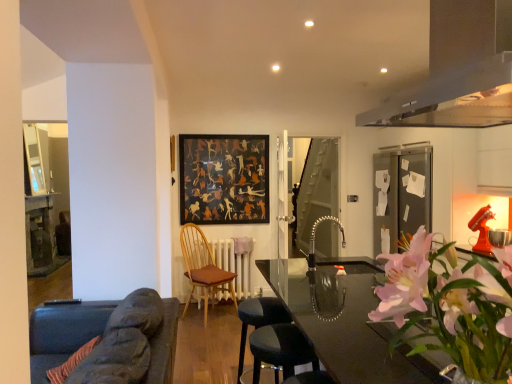
Question: Is dark gray fabric bar stool at lower center, arranged as the 1th bar stool when viewed from the front, thinner than satin black exhaust hood at upper right?

Choices:
 (A) no
 (B) yes

Answer: (B)

Question: Does dark gray fabric bar stool at lower center, acting as the second bar stool starting from the back, have a greater width compared to satin black exhaust hood at upper right?

Choices:
 (A) no
 (B) yes

Answer: (A)

Question: Does dark gray fabric bar stool at lower center, acting as the second bar stool starting from the back, have a lesser height compared to satin black exhaust hood at upper right?

Choices:
 (A) yes
 (B) no

Answer: (A)

Question: Is dark gray fabric bar stool at lower center, acting as the second bar stool starting from the back, positioned in front of satin black exhaust hood at upper right?

Choices:
 (A) yes
 (B) no

Answer: (B)

Question: Does dark gray fabric bar stool at lower center, acting as the second bar stool starting from the back, have a larger size compared to satin black exhaust hood at upper right?

Choices:
 (A) yes
 (B) no

Answer: (B)

Question: Is dark gray fabric bar stool at lower center, arranged as the 1th bar stool when viewed from the front, to the left of satin black exhaust hood at upper right from the viewer's perspective?

Choices:
 (A) yes
 (B) no

Answer: (A)

Question: Could wooden table at left, which is the first table in back-to-front order, be considered to be inside pink floral arrangement at right?

Choices:
 (A) yes
 (B) no

Answer: (B)

Question: From the image's perspective, is pink floral arrangement at right beneath wooden table at left, the 2th table when ordered from front to back?

Choices:
 (A) yes
 (B) no

Answer: (B)

Question: From a real-world perspective, is pink floral arrangement at right on top of wooden table at left, the 2th table when ordered from front to back?

Choices:
 (A) yes
 (B) no

Answer: (A)

Question: Can you confirm if pink floral arrangement at right is thinner than wooden table at left, which is the first table in back-to-front order?

Choices:
 (A) no
 (B) yes

Answer: (B)

Question: Is wooden table at left, the first table positioned from the left, at the back of pink floral arrangement at right?

Choices:
 (A) yes
 (B) no

Answer: (B)

Question: Considering the relative sizes of pink floral arrangement at right and wooden table at left, the first table positioned from the left, in the image provided, is pink floral arrangement at right wider than wooden table at left, the first table positioned from the left,?

Choices:
 (A) yes
 (B) no

Answer: (B)

Question: Could you tell me if black matte picture frame at center is turned towards transparent glass table at center, acting as the 1th table starting from the front?

Choices:
 (A) yes
 (B) no

Answer: (A)